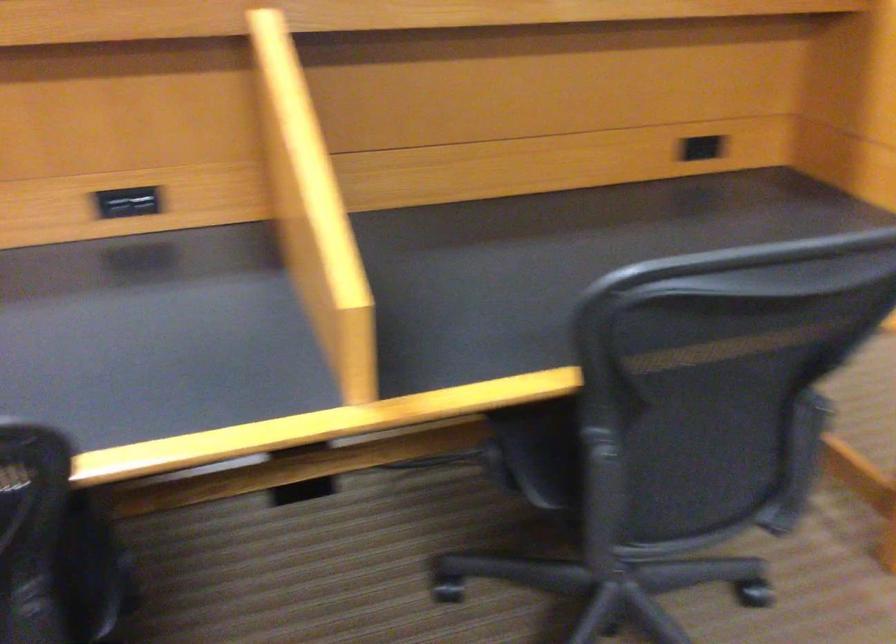
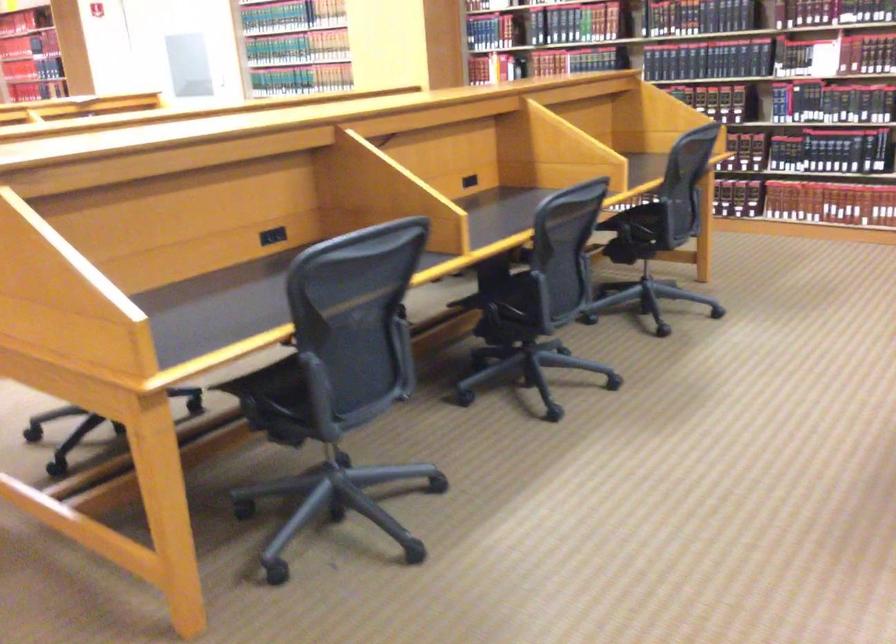
Question: I am providing you with two images of the same scene from different viewpoints. After the viewpoint changes to image2, which objects are now occluded?

Choices:
 (A) chair armrest
 (B) hardcover book
 (C) black power outlet
 (D) white door lock

Answer: (A)